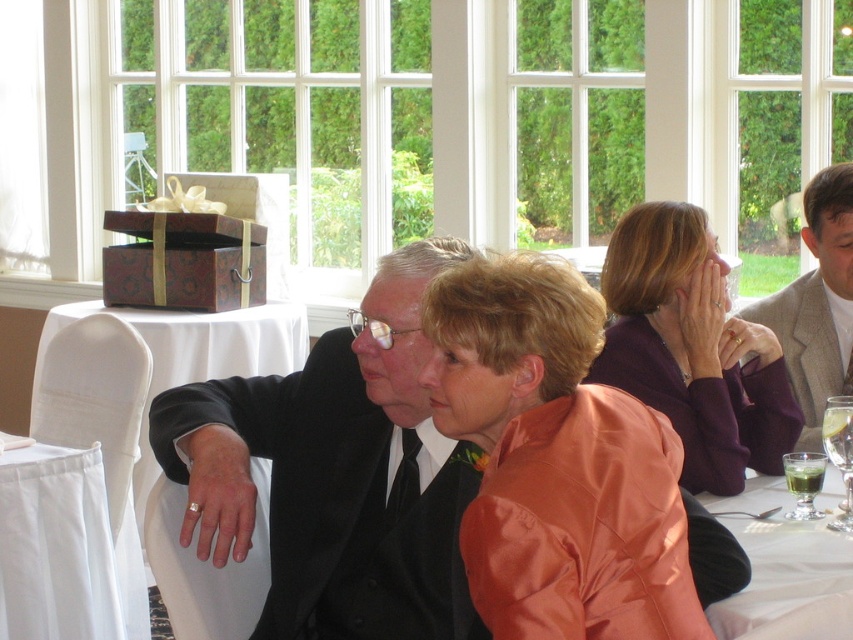
Question: Among these objects, which one is farthest from the camera?

Choices:
 (A) clear glass wine glass at lower right
 (B) black satin suit at center
 (C) purple satin jacket at center

Answer: (C)

Question: Which of these objects is positioned closest to the green translucent glass at lower right?

Choices:
 (A) satin orange jacket at center
 (B) white cloth at lower left
 (C) purple satin jacket at center

Answer: (C)

Question: Which of the following is the closest to the observer?

Choices:
 (A) purple satin jacket at center
 (B) satin orange jacket at center
 (C) green translucent glass at lower right

Answer: (B)

Question: Can you confirm if clear glass at lower right is positioned to the left of clear glass wine glass at lower right?

Choices:
 (A) yes
 (B) no

Answer: (A)

Question: Is gray wool suit at right bigger than white cloth-covered table at left?

Choices:
 (A) no
 (B) yes

Answer: (A)

Question: Is satin orange jacket at center bigger than white cloth at lower left?

Choices:
 (A) yes
 (B) no

Answer: (A)